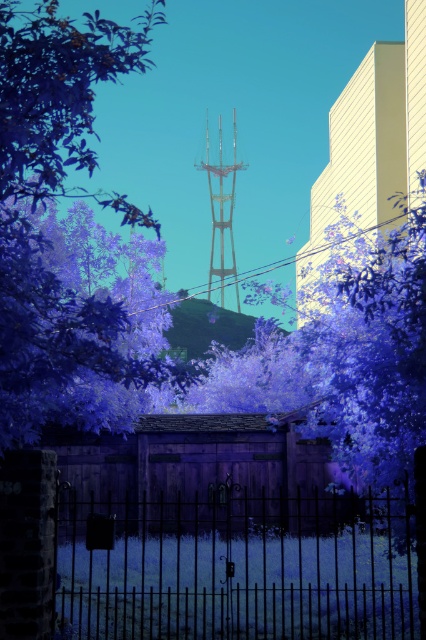
Question: Is the position of purple leafy tree at center less distant than that of purple matte tree at center?

Choices:
 (A) yes
 (B) no

Answer: (A)

Question: Is black wrought iron gate at center to the left of metallic wire at upper center from the viewer's perspective?

Choices:
 (A) no
 (B) yes

Answer: (B)

Question: Can you confirm if black wrought iron gate at center is positioned above smooth beige building at upper right?

Choices:
 (A) yes
 (B) no

Answer: (B)

Question: Which point appears farthest from the camera in this image?

Choices:
 (A) (218, 227)
 (B) (345, 461)

Answer: (A)

Question: Estimate the real-world distances between objects in this image. Which object is farther from the purple leafy tree at center?

Choices:
 (A) purple matte tree at center
 (B) smooth beige building at upper right
 (C) black wrought iron gate at center

Answer: (A)

Question: Considering the real-world distances, which object is closest to the purple matte tree at center?

Choices:
 (A) smooth beige building at upper right
 (B) purple leafy tree at center
 (C) metallic silver tower at center
 (D) metallic wire at upper center

Answer: (A)